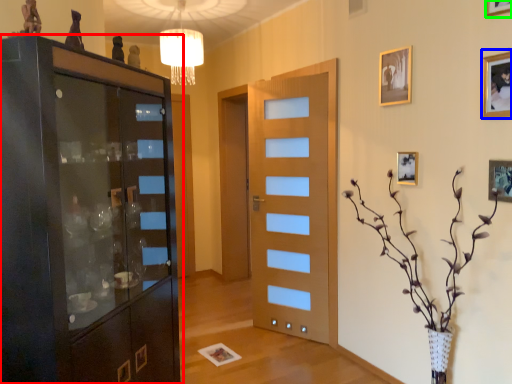
Question: Estimate the real-world distances between objects in this image. Which object is farther from cupboard (highlighted by a red box), picture frame (highlighted by a blue box) or picture frame (highlighted by a green box)?

Choices:
 (A) picture frame
 (B) picture frame

Answer: (B)